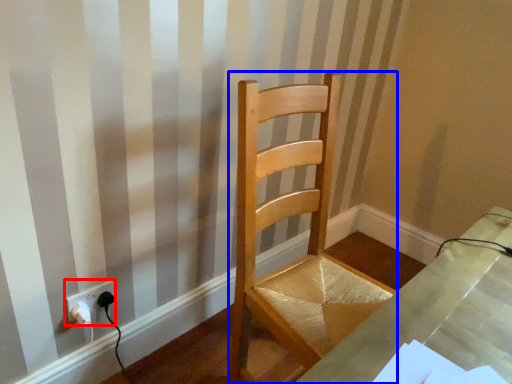
Question: Which object is further to the camera taking this photo, electric outlet (highlighted by a red box) or chair (highlighted by a blue box)?

Choices:
 (A) electric outlet
 (B) chair

Answer: (A)